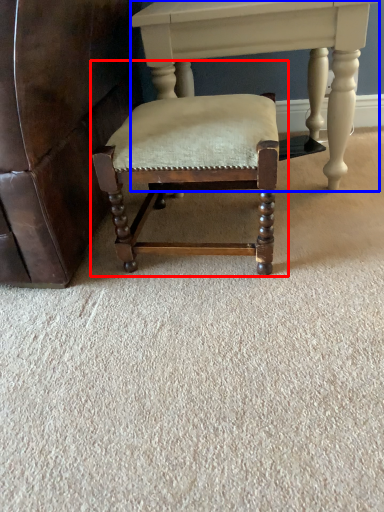
Question: Which point is closer to the camera, chair (highlighted by a red box) or table (highlighted by a blue box)?

Choices:
 (A) chair
 (B) table

Answer: (A)